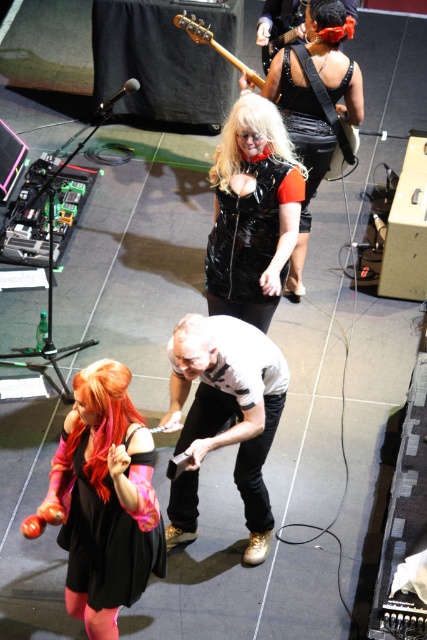
Question: Among these objects, which one is farthest from the camera?

Choices:
 (A) shiny black dress at center
 (B) white matte shirt at center
 (C) black satin dress at lower left

Answer: (A)

Question: Can you confirm if white matte shirt at center is positioned to the right of black glossy guitar at upper center?

Choices:
 (A) no
 (B) yes

Answer: (B)

Question: Which object is closer to the camera taking this photo?

Choices:
 (A) black satin dress at lower left
 (B) blondehair at center

Answer: (A)

Question: Observing the image, what is the correct spatial positioning of black satin dress at lower left in reference to vivid orange hair at lower left?

Choices:
 (A) above
 (B) below

Answer: (B)

Question: Can you confirm if white matte shirt at center is smaller than black satin dress at lower left?

Choices:
 (A) yes
 (B) no

Answer: (B)

Question: Which of the following is the farthest from the observer?

Choices:
 (A) shiny black vest at center
 (B) black satin dress at lower left

Answer: (A)